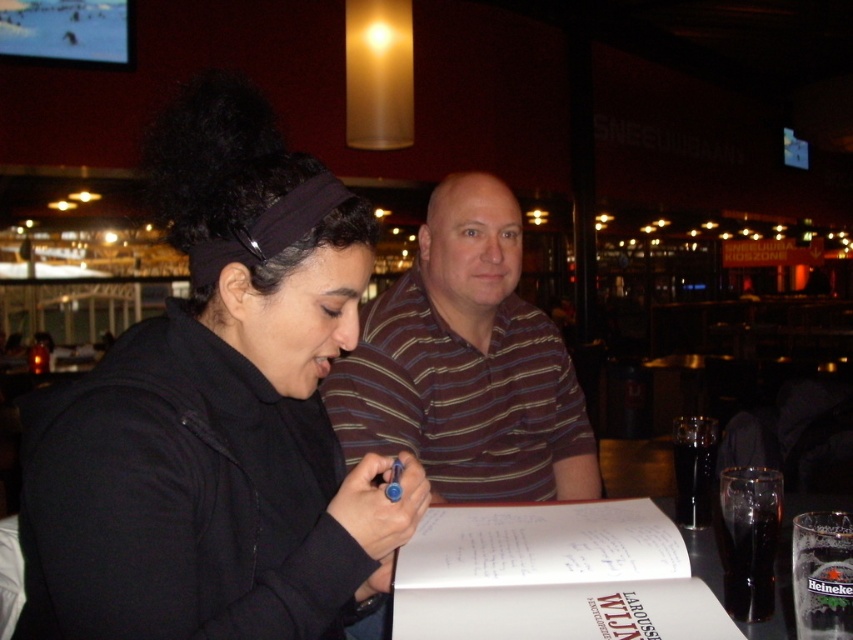
Can you confirm if black matte jacket at center is positioned above striped cotton shirt at center?

Incorrect, black matte jacket at center is not positioned above striped cotton shirt at center.

Is black matte jacket at center positioned behind striped cotton shirt at center?

No, it is in front of striped cotton shirt at center.

Who is more forward, (213, 196) or (540, 330)?

Point (213, 196)

Image resolution: width=853 pixels, height=640 pixels. I want to click on black matte jacket at center, so click(x=213, y=461).

What do you see at coordinates (567, 577) in the screenshot? I see `translucent glass table at center` at bounding box center [567, 577].

Is translucent glass table at center positioned in front of white paper at center?

Yes.

The image size is (853, 640). Identify the location of translucent glass table at center. (567, 577).

Is striped cotton shirt at center below white paper at center?

No.

Is striped cotton shirt at center taller than white paper at center?

Yes.

Locate an element on the screen. striped cotton shirt at center is located at coordinates [466, 364].

Where is `striped cotton shirt at center`? striped cotton shirt at center is located at coordinates point(466,364).